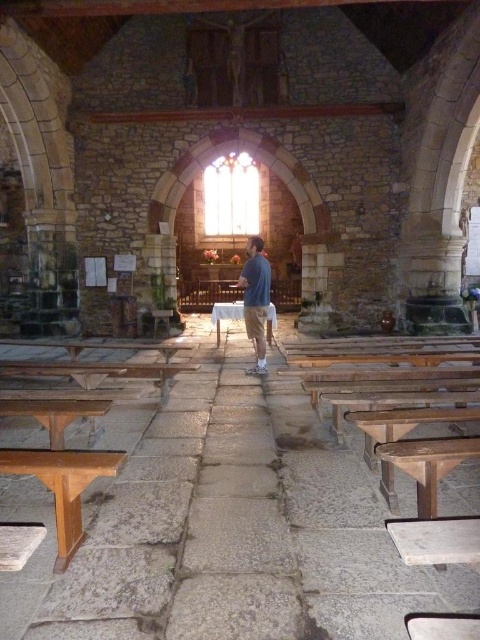
Question: Can you confirm if blue cotton shirt at center is positioned below wooden bench at center?

Choices:
 (A) no
 (B) yes

Answer: (B)

Question: Which point is closer to the camera?

Choices:
 (A) blue cotton shirt at center
 (B) wooden bench at center
 (C) wooden bench at lower left

Answer: (C)

Question: Estimate the real-world distances between objects in this image. Which object is closer to the blue cotton shirt at center?

Choices:
 (A) wooden bench at lower left
 (B) wooden bench at center

Answer: (B)

Question: Is wooden bench at lower left positioned behind blue cotton shirt at center?

Choices:
 (A) no
 (B) yes

Answer: (A)

Question: Is wooden bench at lower left to the left of blue cotton shirt at center from the viewer's perspective?

Choices:
 (A) no
 (B) yes

Answer: (B)

Question: Which point is farther to the camera?

Choices:
 (A) (262, 307)
 (B) (167, 333)
 (C) (71, 524)

Answer: (B)